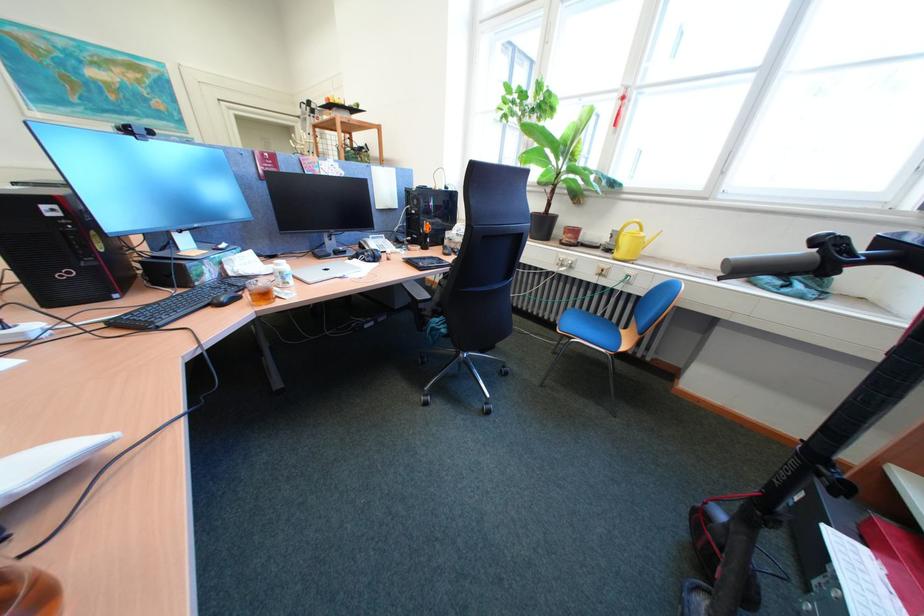
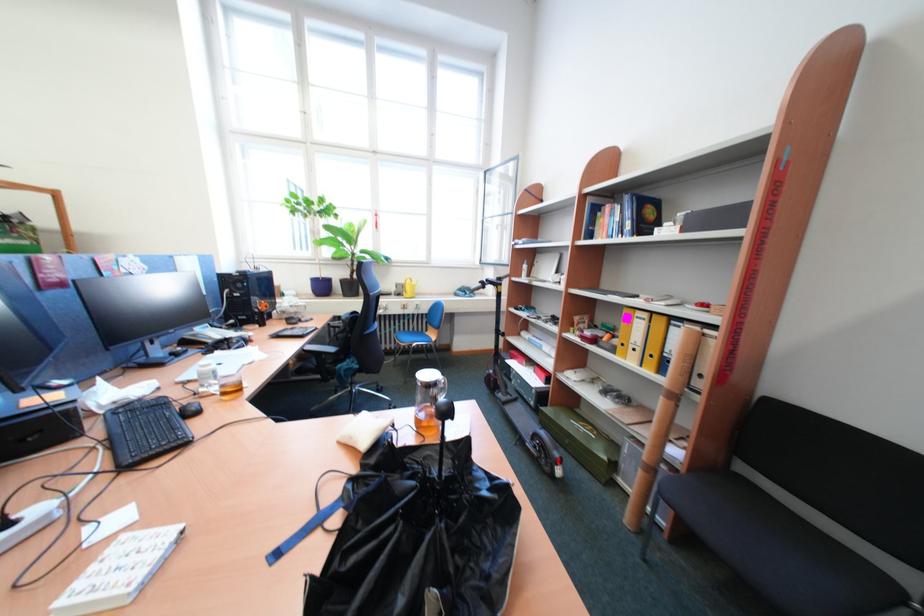
The point at (611, 249) is marked in the first image. Where is the corresponding point in the second image?

(403, 296)